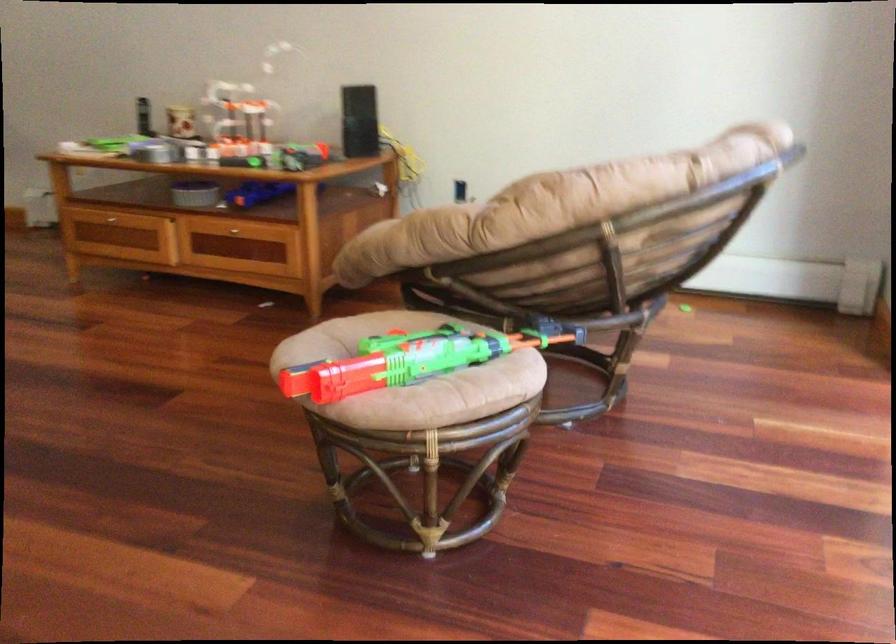
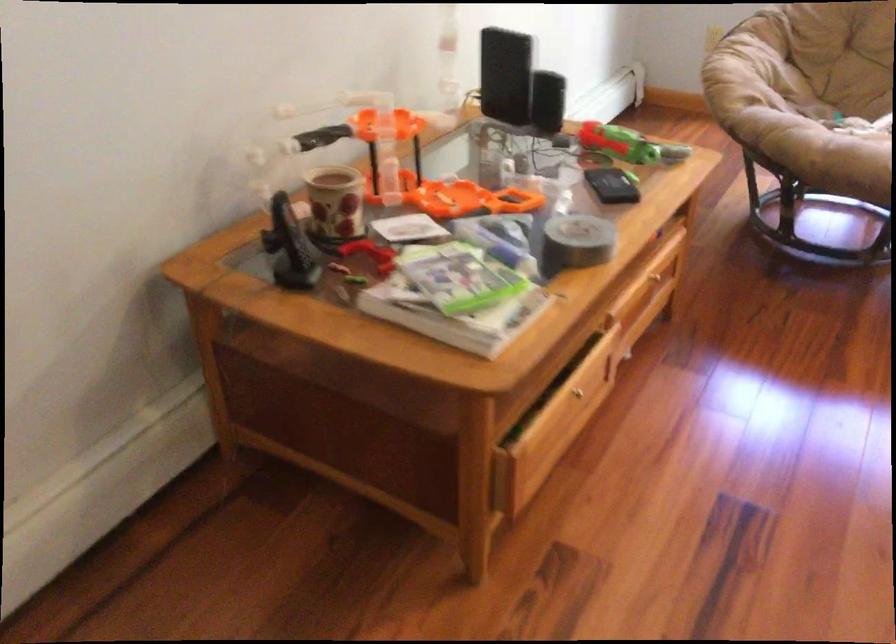
In the second image, find the point that corresponds to [177,120] in the first image.

(334, 203)